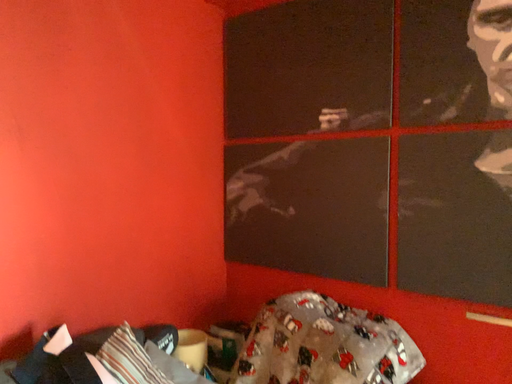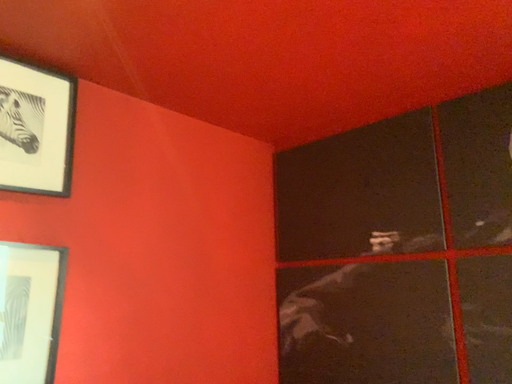
Question: Which way did the camera rotate in the video?

Choices:
 (A) rotated upward
 (B) rotated downward

Answer: (A)